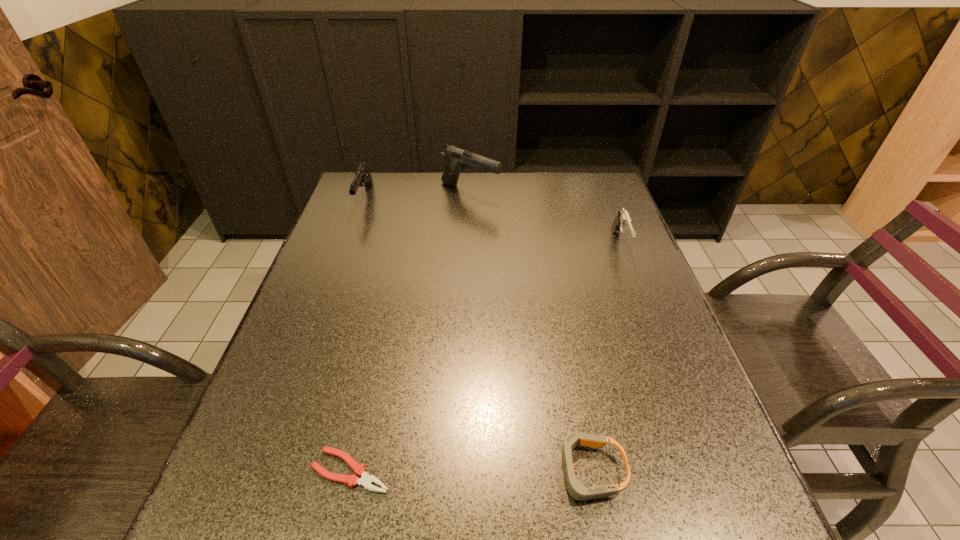
The width and height of the screenshot is (960, 540). I want to click on object present at the far left corner, so click(363, 177).

This screenshot has height=540, width=960. I want to click on vacant area at the far edge, so click(x=429, y=173).

Image resolution: width=960 pixels, height=540 pixels. In the image, there is a desktop. In order to click on vacant space at the left edge in this screenshot , I will do `click(273, 391)`.

In the image, there is a desktop. At what (x,y) coordinates should I click in order to perform the action: click on vacant space at the right edge. Please return your answer as a coordinate pair (x, y). Looking at the image, I should click on (639, 245).

What are the coordinates of `blank space at the far right corner` in the screenshot? It's located at (577, 187).

Identify the location of vacant space that is in between the leftmost object and the rightmost gun. Image resolution: width=960 pixels, height=540 pixels. (492, 222).

Where is `free space between the leftmost object and the goggles`? The image size is (960, 540). free space between the leftmost object and the goggles is located at coordinates (477, 335).

Where is `empty space that is in between the leftmost gun and the third nearest object`? This screenshot has height=540, width=960. empty space that is in between the leftmost gun and the third nearest object is located at coordinates (492, 222).

Locate an element on the screen. This screenshot has height=540, width=960. free spot between the pliers and the leftmost object is located at coordinates (358, 335).

At what (x,y) coordinates should I click in order to perform the action: click on free space that is in between the pliers and the leftmost gun. Please return your answer as a coordinate pair (x, y). Looking at the image, I should click on (358, 335).